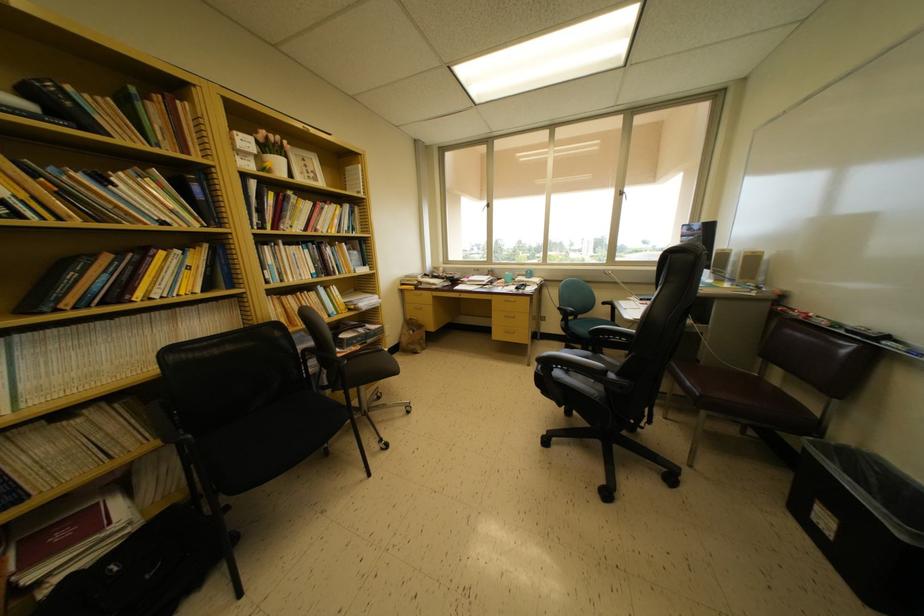
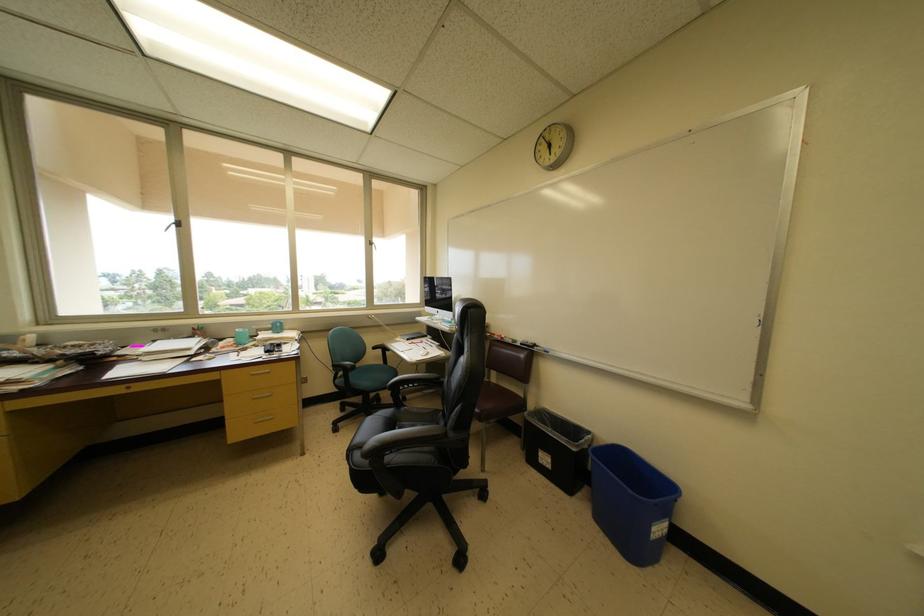
The point at (563,314) is marked in the first image. Where is the corresponding point in the second image?

(338, 371)